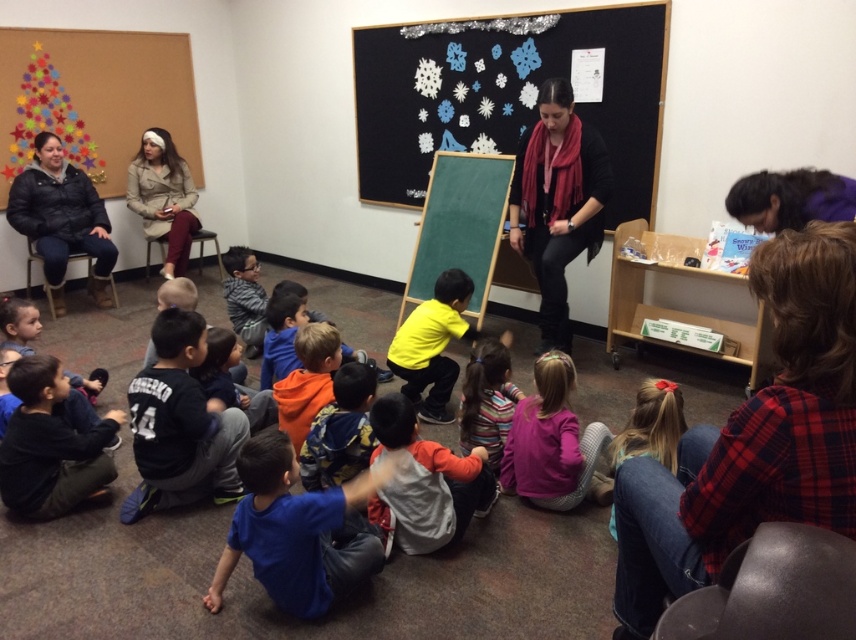
You are a student in the classroom and want to know which jacket is narrower between the black fleece jacket at center and the beige leather jacket at upper left. Can you determine this based on their positions?

The black fleece jacket at center has a lesser width compared to the beige leather jacket at upper left, so the black fleece jacket at center is narrower.

You are a student in the classroom and need to hang a poster on the wall. The poster is the same size as the orange fleece jacket at center. Will the poster fit on the blackboard with paper snowflakes at upper center?

The blackboard with paper snowflakes at upper center is larger in size than the orange fleece jacket at center, so the poster will fit on the blackboard with paper snowflakes at upper center.

You are a student in the classroom and you want to hand a note to the teacher who is standing at the front. There is a flannel shirt at lower right on the floor. Can you reach the teacher without stepping on the flannel shirt?

The flannel shirt at lower right is located at point (753, 438). Since you can move around it, you can reach the teacher without stepping on the flannel shirt.